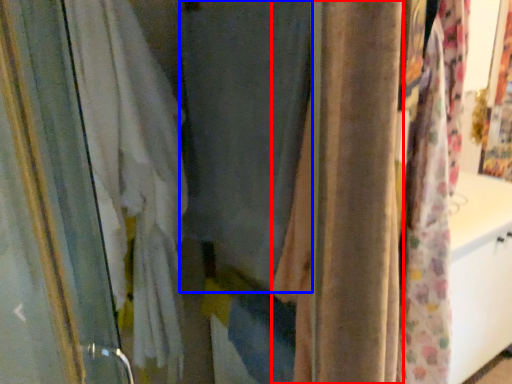
Question: Which object is closer to the camera taking this photo, curtain (highlighted by a red box) or curtain (highlighted by a blue box)?

Choices:
 (A) curtain
 (B) curtain

Answer: (A)